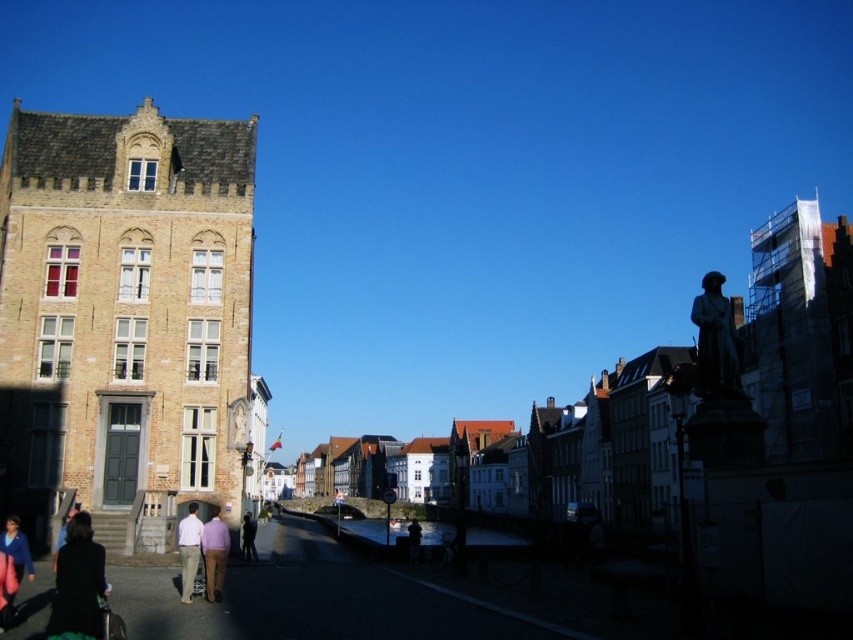
Is point (123, 436) behind point (80, 547)?

Yes, it is behind point (80, 547).

This screenshot has width=853, height=640. In order to click on brick building at left in this screenshot , I will do `click(125, 317)`.

You are a GUI agent. You are given a task and a screenshot of the screen. Output one action in this format:
    pyautogui.click(x=<x>, y=<y>)
    Task: Click on the brick building at left
    This screenshot has height=640, width=853.
    Given the screenshot: What is the action you would take?
    pyautogui.click(x=125, y=317)

Consider the image. Can you confirm if dark brown leather jacket at lower left is thinner than dark gray fabric jacket at center?

In fact, dark brown leather jacket at lower left might be wider than dark gray fabric jacket at center.

Does dark brown leather jacket at lower left appear on the left side of dark gray fabric jacket at center?

Yes, dark brown leather jacket at lower left is to the left of dark gray fabric jacket at center.

What do you see at coordinates (78, 584) in the screenshot?
I see `dark brown leather jacket at lower left` at bounding box center [78, 584].

At what (x,y) coordinates should I click in order to perform the action: click on dark brown leather jacket at lower left. Please return your answer as a coordinate pair (x, y). Image resolution: width=853 pixels, height=640 pixels. Looking at the image, I should click on (78, 584).

In the scene shown: Measure the distance from light pink shirt at center to blue fabric jacket at lower left.

light pink shirt at center and blue fabric jacket at lower left are 9.84 meters apart.

Which is below, light pink shirt at center or blue fabric jacket at lower left?

blue fabric jacket at lower left

Between point (204, 572) and point (28, 561), which one is positioned behind?

Point (204, 572)

Image resolution: width=853 pixels, height=640 pixels. Identify the location of light pink shirt at center. (213, 554).